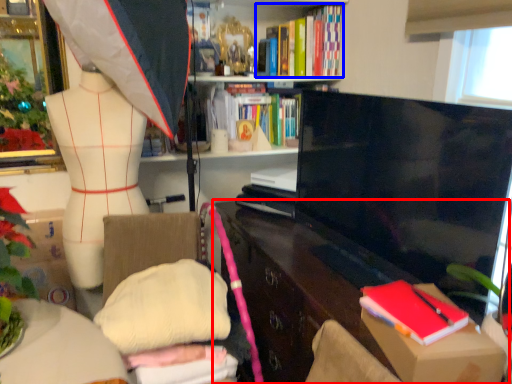
Question: Which object appears closest to the camera in this image, cabinetry (highlighted by a red box) or book (highlighted by a blue box)?

Choices:
 (A) cabinetry
 (B) book

Answer: (A)